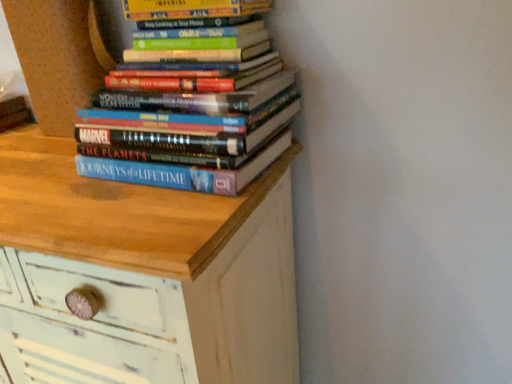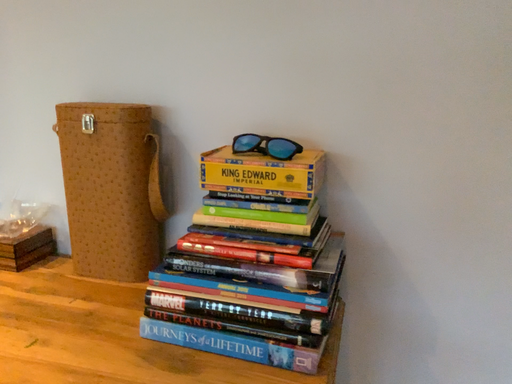
Question: How did the camera likely rotate when shooting the video?

Choices:
 (A) rotated downward
 (B) rotated upward

Answer: (B)